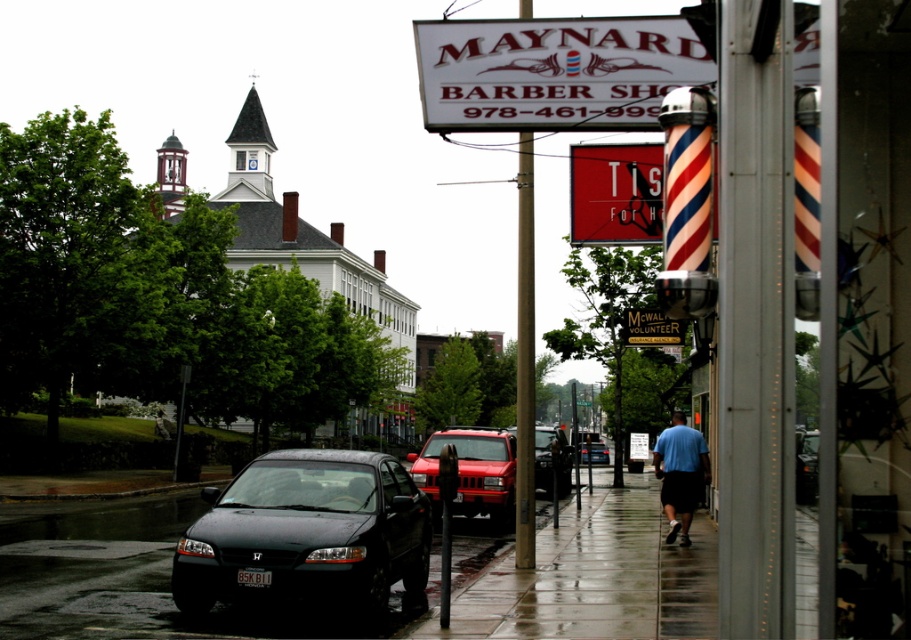
Which is above, light blue shirt at center or matte black suv at center?

light blue shirt at center

Is light blue shirt at center wider than matte black suv at center?

Incorrect, light blue shirt at center's width does not surpass matte black suv at center's.

What do you see at coordinates (681, 474) in the screenshot?
I see `light blue shirt at center` at bounding box center [681, 474].

This screenshot has width=911, height=640. In order to click on light blue shirt at center in this screenshot , I will do `click(681, 474)`.

Can you confirm if matte black sedan at lower left is smaller than white plastic sign at upper center?

Yes, matte black sedan at lower left is smaller than white plastic sign at upper center.

Where is `matte black sedan at lower left`? matte black sedan at lower left is located at coordinates (306, 534).

Is shiny red suv at center to the left of matte black suv at center from the viewer's perspective?

Correct, you'll find shiny red suv at center to the left of matte black suv at center.

This screenshot has height=640, width=911. Identify the location of shiny red suv at center. (472, 472).

Image resolution: width=911 pixels, height=640 pixels. What do you see at coordinates (472, 472) in the screenshot?
I see `shiny red suv at center` at bounding box center [472, 472].

I want to click on shiny red suv at center, so click(472, 472).